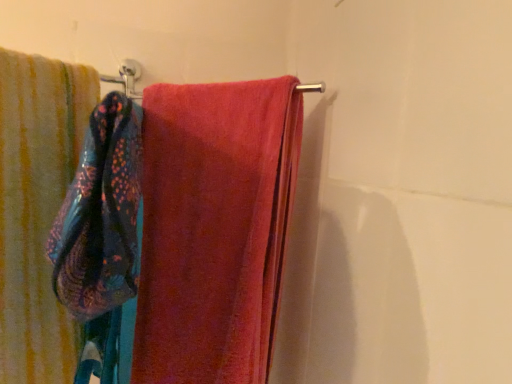
Question: Is blue textured towel at left not inside soft cotton towel at left, the 2th towel from the right?

Choices:
 (A) yes
 (B) no

Answer: (B)

Question: Would you say soft cotton towel at left, the 2th towel from the right, is part of blue textured towel at left's contents?

Choices:
 (A) yes
 (B) no

Answer: (B)

Question: Is the depth of blue textured towel at left greater than that of soft cotton towel at left, which is the first towel from left to right?

Choices:
 (A) no
 (B) yes

Answer: (A)

Question: Is blue textured towel at left at the left side of soft cotton towel at left, which is the first towel from left to right?

Choices:
 (A) no
 (B) yes

Answer: (A)

Question: Considering the relative sizes of blue textured towel at left and soft cotton towel at left, the 2th towel from the right, in the image provided, is blue textured towel at left taller than soft cotton towel at left, the 2th towel from the right,?

Choices:
 (A) no
 (B) yes

Answer: (A)

Question: In terms of size, does soft pink towel at center, which is counted as the 2th towel, starting from the left, appear bigger or smaller than blue textured towel at left?

Choices:
 (A) small
 (B) big

Answer: (B)

Question: Does point (216, 142) appear closer or farther from the camera than point (78, 286)?

Choices:
 (A) farther
 (B) closer

Answer: (A)

Question: Considering the relative positions of soft pink towel at center, which appears as the 1th towel when viewed from the right, and blue textured towel at left in the image provided, is soft pink towel at center, which appears as the 1th towel when viewed from the right, to the left or to the right of blue textured towel at left?

Choices:
 (A) right
 (B) left

Answer: (A)

Question: From the image's perspective, is soft pink towel at center, which is counted as the 2th towel, starting from the left, positioned above or below blue textured towel at left?

Choices:
 (A) above
 (B) below

Answer: (B)

Question: Considering their positions, is blue textured towel at left located in front of or behind soft pink towel at center, which appears as the 1th towel when viewed from the right?

Choices:
 (A) behind
 (B) front

Answer: (B)

Question: In the image, is blue textured towel at left on the left side or the right side of soft pink towel at center, which is counted as the 2th towel, starting from the left?

Choices:
 (A) left
 (B) right

Answer: (A)

Question: Is blue textured towel at left wider or thinner than soft pink towel at center, which is counted as the 2th towel, starting from the left?

Choices:
 (A) thin
 (B) wide

Answer: (A)

Question: From the image's perspective, relative to soft pink towel at center, which is counted as the 2th towel, starting from the left, is blue textured towel at left above or below?

Choices:
 (A) below
 (B) above

Answer: (B)

Question: Considering their positions, is soft pink towel at center, which is counted as the 2th towel, starting from the left, located in front of or behind soft cotton towel at left, the 2th towel from the right?

Choices:
 (A) behind
 (B) front

Answer: (A)

Question: Do you think soft pink towel at center, which appears as the 1th towel when viewed from the right, is within soft cotton towel at left, which is the first towel from left to right, or outside of it?

Choices:
 (A) inside
 (B) outside

Answer: (B)